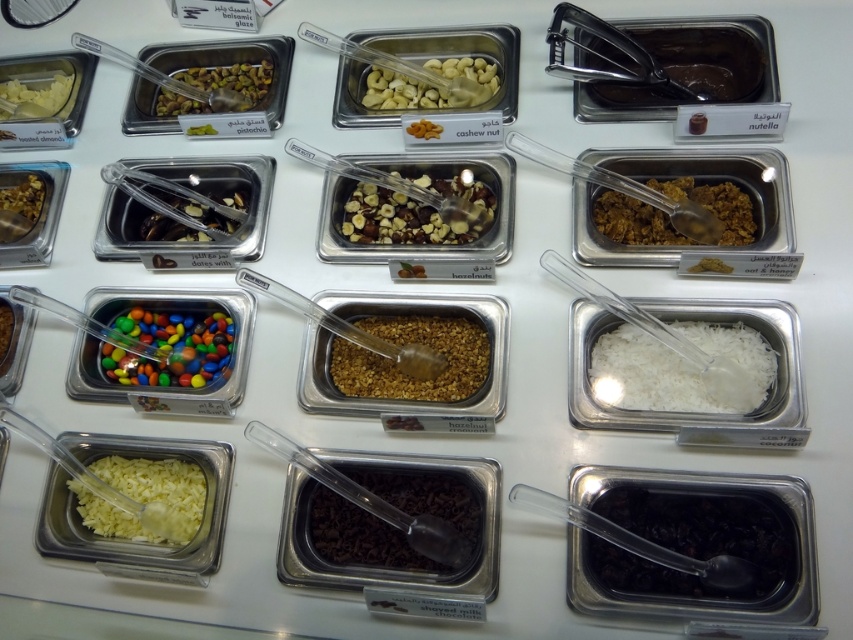
You are an ice cream server and need to locate the dark chocolate chips at center based on coordinates. If the white surface is a grid from 0 to 1 on both axes, where would you find them?

The dark chocolate chips at center are located at the coordinates point (364,538) on the grid.

Based on the scene description, what is located at the coordinates point (364,538)?

The coordinates point (364,538) correspond to dark chocolate chips at center.